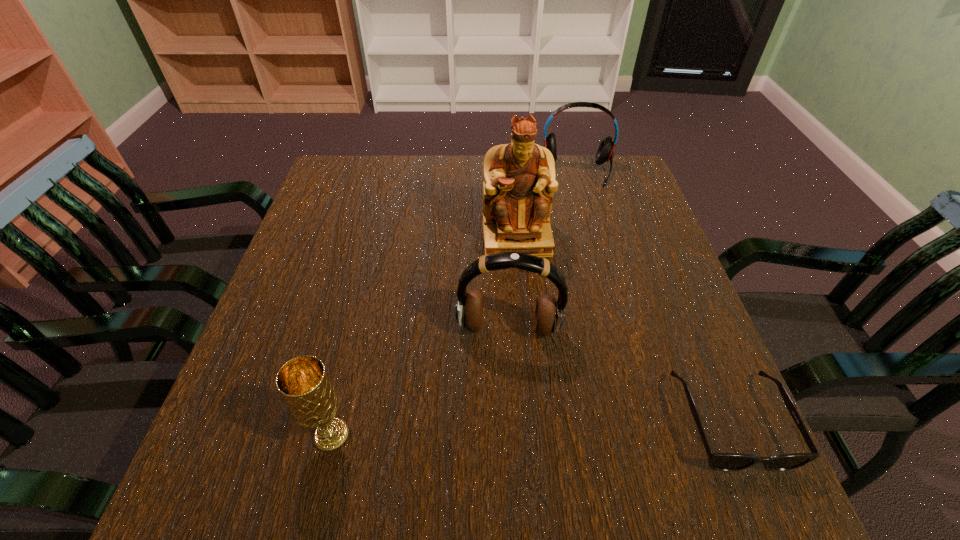
Image resolution: width=960 pixels, height=540 pixels. What are the coordinates of `sunglasses that is at the near edge` in the screenshot? It's located at (718, 461).

This screenshot has width=960, height=540. I want to click on object positioned at the left edge, so click(303, 382).

Where is `sunglasses situated at the right edge`? Image resolution: width=960 pixels, height=540 pixels. sunglasses situated at the right edge is located at coordinates (718, 461).

Where is `headset at the right edge`? Image resolution: width=960 pixels, height=540 pixels. headset at the right edge is located at coordinates (605, 151).

Image resolution: width=960 pixels, height=540 pixels. I want to click on object present at the near left corner, so click(303, 382).

Where is `object that is at the far right corner`? This screenshot has width=960, height=540. object that is at the far right corner is located at coordinates (605, 151).

The image size is (960, 540). I want to click on object located at the near right corner, so click(718, 461).

The image size is (960, 540). In the image, there is a desktop. In order to click on vacant space at the far edge in this screenshot , I will do `click(460, 184)`.

In the image, there is a desktop. Where is `vacant space at the near edge`? vacant space at the near edge is located at coordinates (425, 405).

Locate an element on the screen. The image size is (960, 540). free point at the left edge is located at coordinates (260, 386).